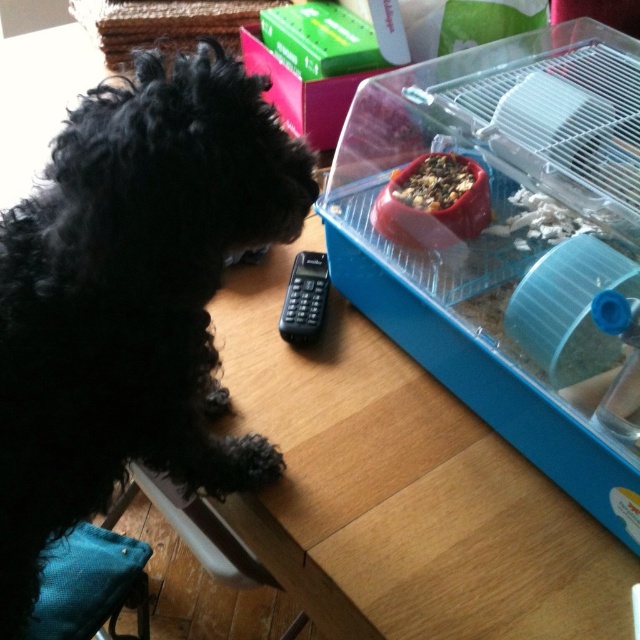
Question: In this image, where is black curly fur dog at left located relative to brown textured food at center?

Choices:
 (A) below
 (B) above

Answer: (A)

Question: Among these points, which one is nearest to the camera?

Choices:
 (A) (528, 72)
 (B) (35, 362)

Answer: (B)

Question: Can you confirm if wooden table at lower left is thinner than brown textured food at center?

Choices:
 (A) yes
 (B) no

Answer: (B)

Question: Which object is farther from the camera taking this photo?

Choices:
 (A) transparent plastic bird cage at right
 (B) brown textured food at center

Answer: (B)

Question: Does black curly fur dog at left come in front of brown textured food at center?

Choices:
 (A) yes
 (B) no

Answer: (A)

Question: Among these points, which one is farthest from the camera?

Choices:
 (A) (500, 244)
 (B) (452, 186)
 (C) (364, 557)

Answer: (A)